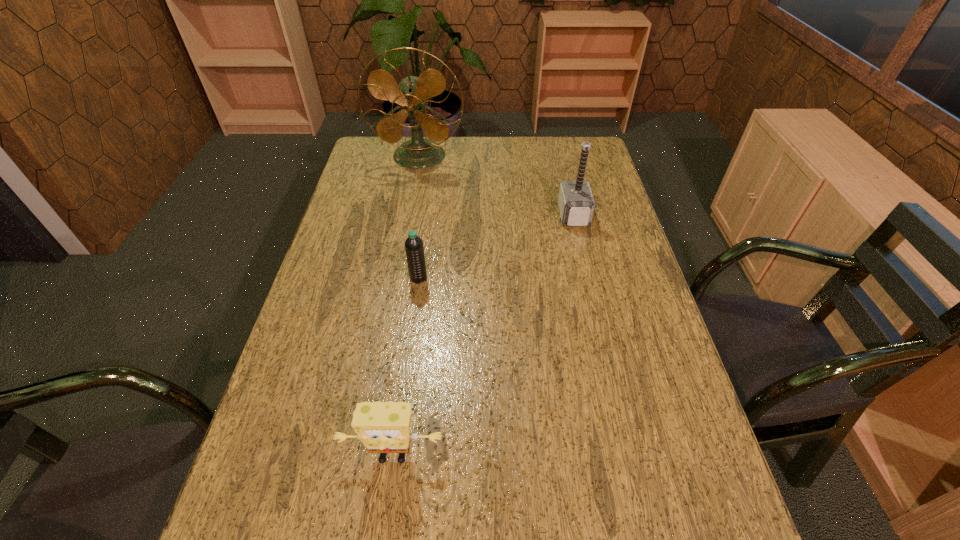
Where is `fan`? fan is located at coordinates (412, 95).

The height and width of the screenshot is (540, 960). I want to click on the tallest object, so click(412, 95).

I want to click on the rightmost object, so click(x=576, y=204).

The height and width of the screenshot is (540, 960). I want to click on the second farthest object, so [x=576, y=204].

The width and height of the screenshot is (960, 540). Find the location of `water bottle`. water bottle is located at coordinates (414, 248).

Locate an element on the screen. The image size is (960, 540). sponge is located at coordinates (384, 427).

What are the coordinates of `free space located in front of the fan, directing air flow` in the screenshot? It's located at (404, 238).

The width and height of the screenshot is (960, 540). Identify the location of free space located for striking with the head of the second tallest object. (477, 215).

This screenshot has height=540, width=960. I want to click on vacant space situated 0.090m for striking with the head of the second tallest object, so 531,215.

Locate an element on the screen. The height and width of the screenshot is (540, 960). vacant space located for striking with the head of the second tallest object is located at coordinates (543, 215).